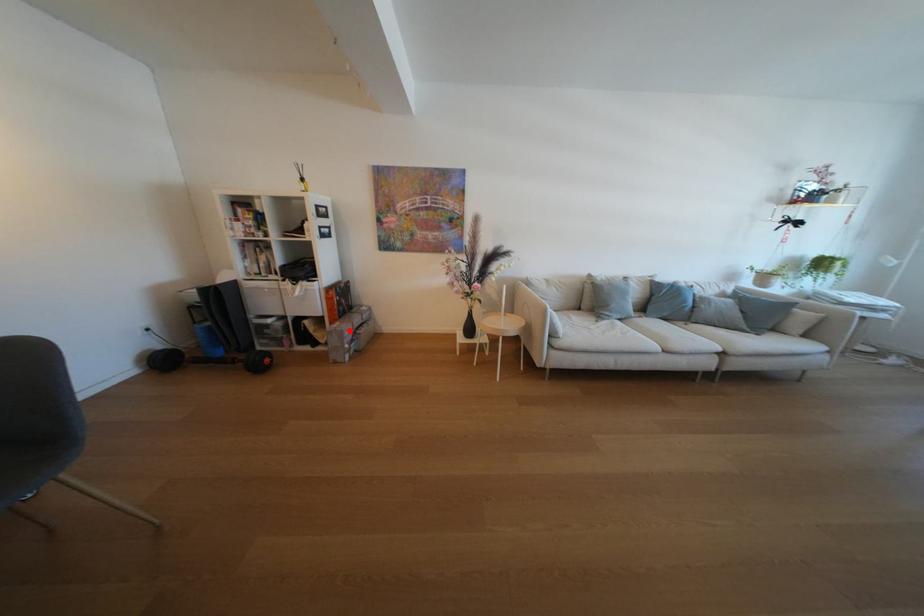
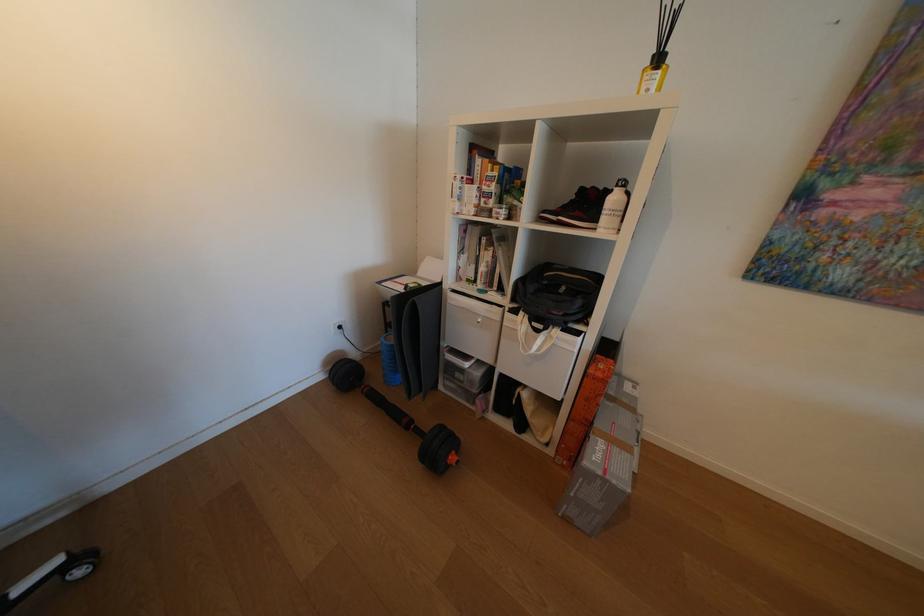
Question: I am providing you with two images of the same scene from different viewpoints. A red point is shown in image1. For the corresponding object point in image2, is it positioned nearer or farther from the camera?

Choices:
 (A) Nearer
 (B) Farther

Answer: (B)